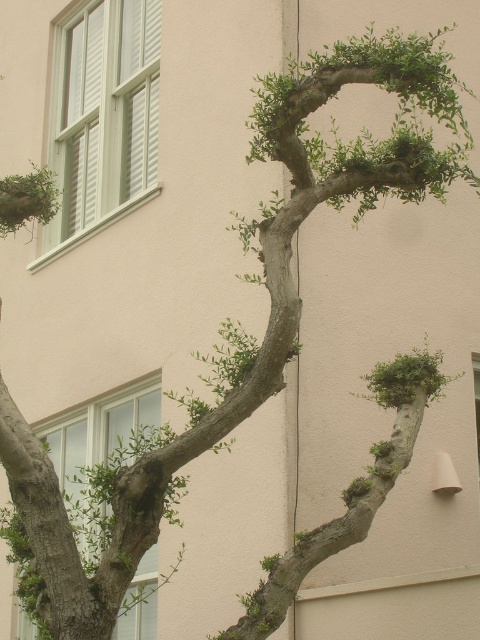
Question: Is green leafy branch at center-right behind green leafy branch at upper left?

Choices:
 (A) yes
 (B) no

Answer: (A)

Question: Among these points, which one is nearest to the camera?

Choices:
 (A) (412, 360)
 (B) (20, 209)

Answer: (B)

Question: Which of the following is the closest to the observer?

Choices:
 (A) (17, 196)
 (B) (421, 396)

Answer: (A)

Question: Is green leafy branch at center-right positioned before green leafy branch at upper left?

Choices:
 (A) no
 (B) yes

Answer: (A)

Question: Is green leafy branch at center-right thinner than green leafy branch at upper left?

Choices:
 (A) yes
 (B) no

Answer: (B)

Question: Which of the following is the closest to the observer?

Choices:
 (A) green leafy branch at upper left
 (B) green leafy branch at center-right

Answer: (A)